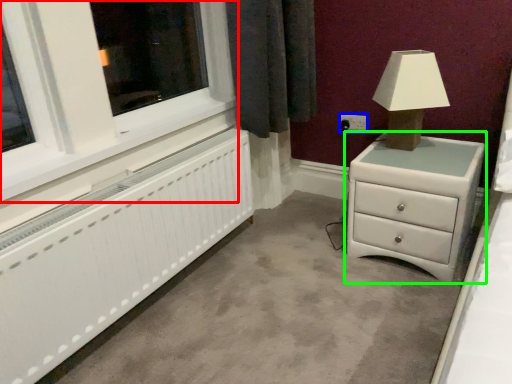
Question: Based on their relative distances, which object is farther from window frame (highlighted by a red box)? Choose from electric outlet (highlighted by a blue box) and chest of drawers (highlighted by a green box).

Choices:
 (A) electric outlet
 (B) chest of drawers

Answer: (A)